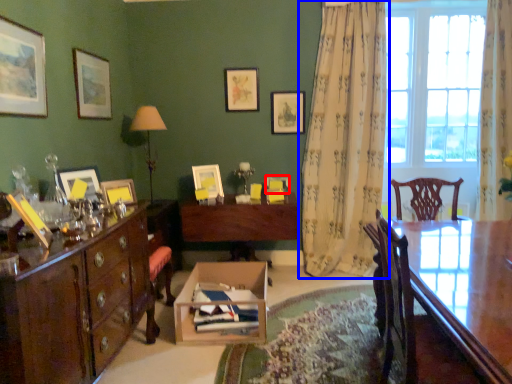
Question: Which object appears farthest to the camera in this image, picture frame (highlighted by a red box) or curtain (highlighted by a blue box)?

Choices:
 (A) picture frame
 (B) curtain

Answer: (A)